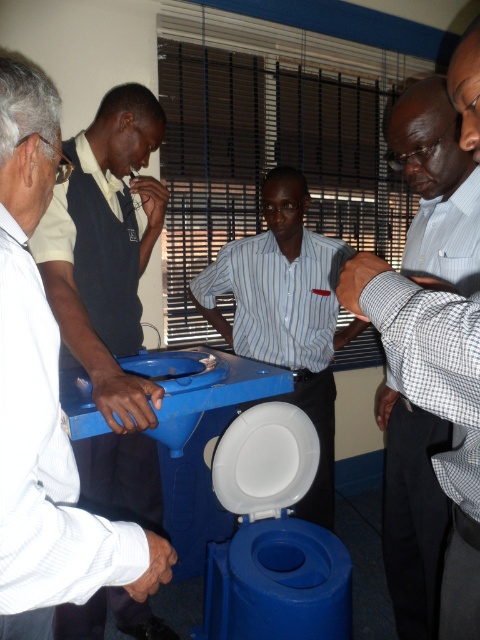
You are a photographer trying to capture a clear photo of the white checkered shirt at center and the striped cotton shirt at center. Which shirt should you focus on first to ensure both are in focus, considering their positions?

The white checkered shirt at center is positioned under the striped cotton shirt at center, so focusing on the striped cotton shirt at center first would allow both shirts to be in focus as the white checkered shirt at center is behind it.

You are standing in front of the blue plastic toilet at left and the white checkered shirt at center. Which object is nearer to you?

The blue plastic toilet at left is closer to the viewer than the white checkered shirt at center.

You are an interior designer planning to place the blue plastic toilet at left and the striped cotton shirt at center in a small bathroom. Which object will require more horizontal space?

The striped cotton shirt at center requires more horizontal space because it is wider than the blue plastic toilet at left.